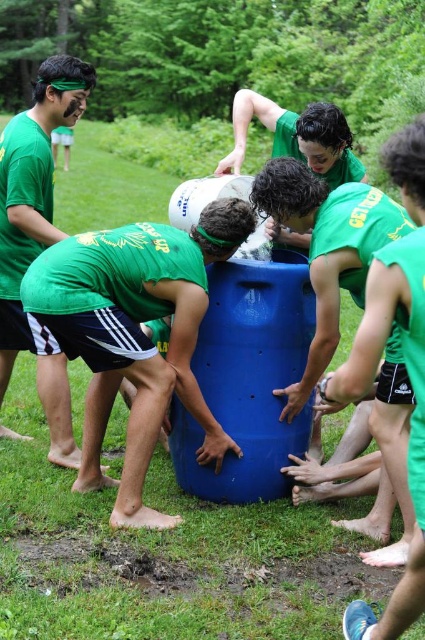
Does matte blue barrel at center have a greater width compared to matte green t-shirt at upper left?

Indeed, matte blue barrel at center has a greater width compared to matte green t-shirt at upper left.

Who is more forward, (192,406) or (85,99)?

Point (192,406) is in front.

Find the location of a particular element. matte blue barrel at center is located at coordinates (136, 333).